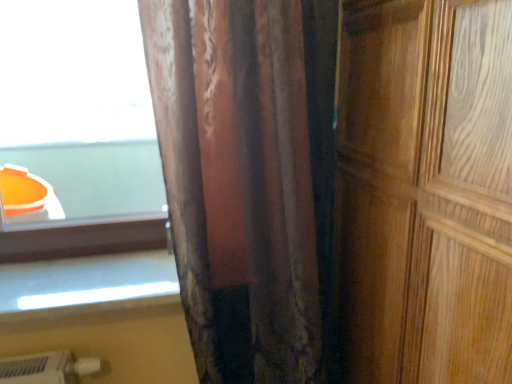
Question: Considering the relative sizes of wooden door at right and velvet-like brown curtain at center in the image provided, is wooden door at right bigger than velvet-like brown curtain at center?

Choices:
 (A) no
 (B) yes

Answer: (B)

Question: Does wooden door at right appear on the left side of velvet-like brown curtain at center?

Choices:
 (A) yes
 (B) no

Answer: (B)

Question: Could you tell me if wooden door at right is facing velvet-like brown curtain at center?

Choices:
 (A) yes
 (B) no

Answer: (A)

Question: Does wooden door at right have a greater height compared to velvet-like brown curtain at center?

Choices:
 (A) no
 (B) yes

Answer: (B)

Question: Considering the relative sizes of wooden door at right and velvet-like brown curtain at center in the image provided, is wooden door at right smaller than velvet-like brown curtain at center?

Choices:
 (A) yes
 (B) no

Answer: (B)

Question: Considering the positions of point (157, 289) and point (220, 236), is point (157, 289) closer or farther from the camera than point (220, 236)?

Choices:
 (A) closer
 (B) farther

Answer: (B)

Question: From the image's perspective, relative to velvet-like brown curtain at center, is white glossy window sill at lower left above or below?

Choices:
 (A) below
 (B) above

Answer: (A)

Question: From a real-world perspective, is white glossy window sill at lower left positioned above or below velvet-like brown curtain at center?

Choices:
 (A) below
 (B) above

Answer: (A)

Question: Considering their positions, is white glossy window sill at lower left located in front of or behind velvet-like brown curtain at center?

Choices:
 (A) behind
 (B) front

Answer: (A)

Question: Looking at the image, does wooden door at right seem bigger or smaller compared to white glossy window sill at lower left?

Choices:
 (A) big
 (B) small

Answer: (A)

Question: From the image's perspective, relative to white glossy window sill at lower left, is wooden door at right above or below?

Choices:
 (A) below
 (B) above

Answer: (B)

Question: In the image, is wooden door at right positioned in front of or behind white glossy window sill at lower left?

Choices:
 (A) front
 (B) behind

Answer: (A)

Question: Is wooden door at right taller or shorter than white glossy window sill at lower left?

Choices:
 (A) tall
 (B) short

Answer: (A)

Question: Considering their positions, is white glossy window sill at lower left located in front of or behind wooden door at right?

Choices:
 (A) front
 (B) behind

Answer: (B)

Question: In the image, is white glossy window sill at lower left on the left side or the right side of wooden door at right?

Choices:
 (A) left
 (B) right

Answer: (A)